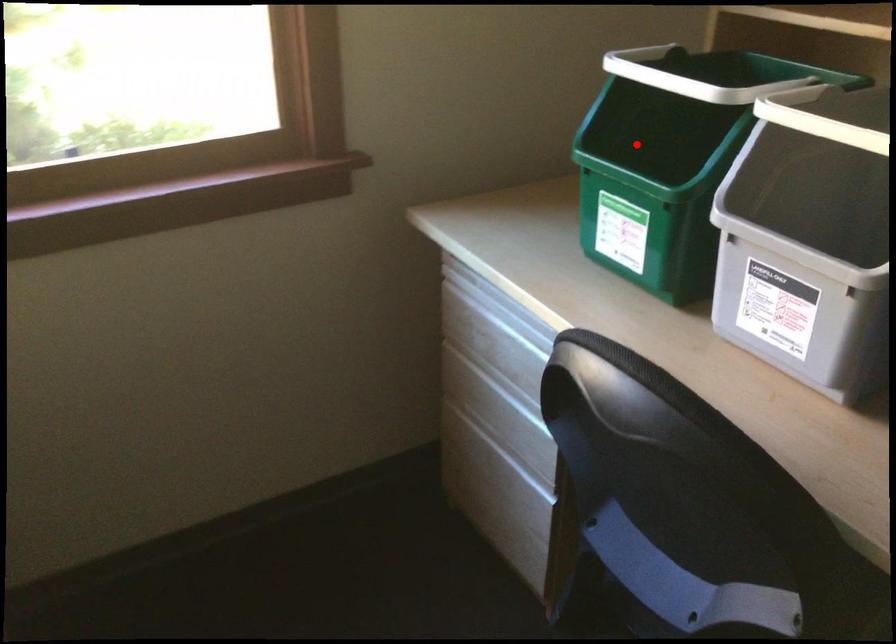
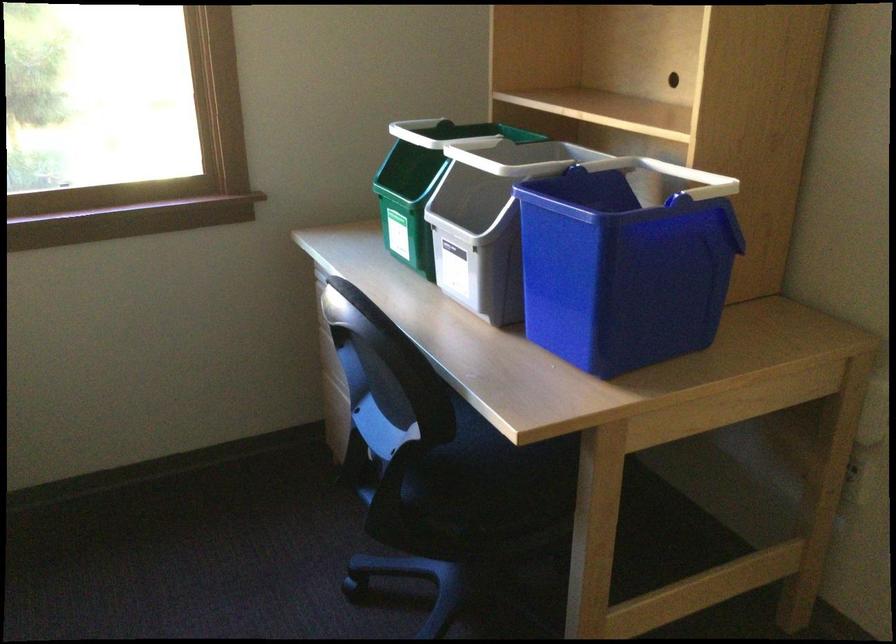
Locate, in the second image, the point that corresponds to the highlighted location in the first image.

(421, 184)